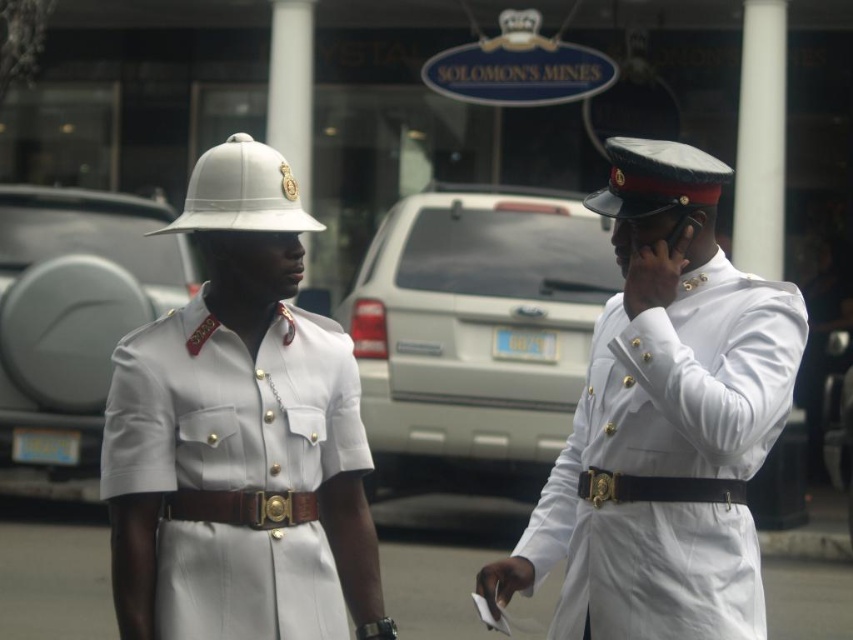
Question: Which of the following is the closest to the observer?

Choices:
 (A) white glossy uniform at center
 (B) white glossy uniform at right

Answer: (A)

Question: Observing the image, what is the correct spatial positioning of white glossy uniform at center in reference to black leather belt at center?

Choices:
 (A) below
 (B) above

Answer: (B)

Question: Which is farther from the white glossy uniform at center?

Choices:
 (A) brown leather belt at center
 (B) white glossy uniform at right

Answer: (B)

Question: Can you confirm if white glossy uniform at center is smaller than brown leather belt at center?

Choices:
 (A) no
 (B) yes

Answer: (A)

Question: Does white glossy uniform at right appear under white glossy uniform at center?

Choices:
 (A) yes
 (B) no

Answer: (B)

Question: Which object is closer to the camera taking this photo?

Choices:
 (A) white glossy uniform at center
 (B) brown leather belt at center
 (C) white glossy uniform at right
 (D) black leather belt at center

Answer: (A)